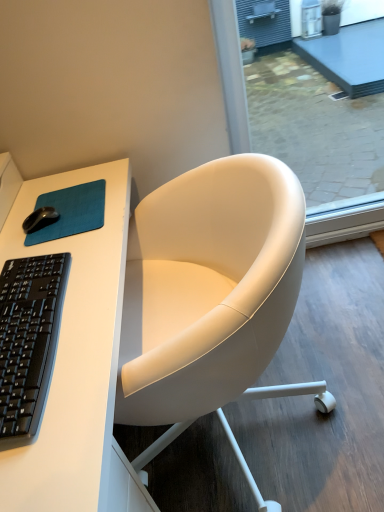
Question: In the image, is transparent glass screen door at upper right on the left side or the right side of white leather chair at center?

Choices:
 (A) right
 (B) left

Answer: (A)

Question: From a real-world perspective, relative to white leather chair at center, is transparent glass screen door at upper right vertically above or below?

Choices:
 (A) below
 (B) above

Answer: (B)

Question: Which object is positioned closest to the transparent glass screen door at upper right?

Choices:
 (A) white matte desk at upper left
 (B) black matte mouse at left
 (C) white leather chair at center
 (D) teal fabric mousepad at upper left
 (E) black matte keyboard at left

Answer: (D)

Question: Which object is the farthest from the black matte keyboard at left?

Choices:
 (A) transparent glass screen door at upper right
 (B) teal fabric mousepad at upper left
 (C) white leather chair at center
 (D) white matte desk at upper left
 (E) black matte mouse at left

Answer: (A)